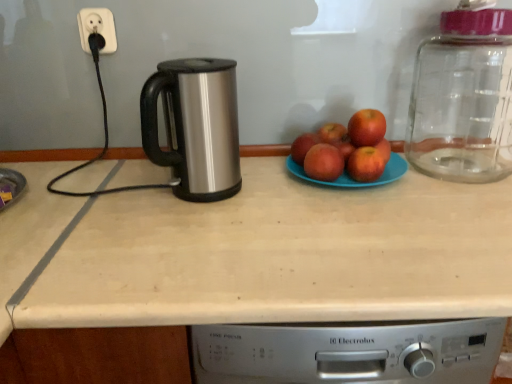
The width and height of the screenshot is (512, 384). Identify the location of free space below transparent glass jar at right (from a real-world perspective). (456, 163).